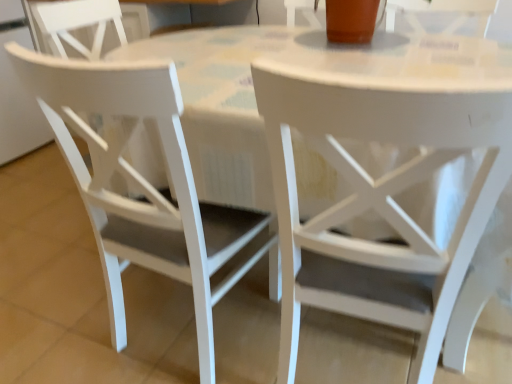
Question: Is white matte chair at center, which is counted as the first chair, starting from the right, behind white matte chair at left, which is the 2th chair in right-to-left order?

Choices:
 (A) yes
 (B) no

Answer: (B)

Question: Is white matte chair at center, positioned as the second chair in left-to-right order, shorter than white matte chair at left, which is the 2th chair in right-to-left order?

Choices:
 (A) no
 (B) yes

Answer: (A)

Question: Does white matte chair at center, which is counted as the first chair, starting from the right, have a larger size compared to white matte chair at left, which is the 2th chair in right-to-left order?

Choices:
 (A) no
 (B) yes

Answer: (B)

Question: From the image's perspective, is white matte chair at center, which is counted as the first chair, starting from the right, under white matte chair at left, the 1th chair when ordered from left to right?

Choices:
 (A) yes
 (B) no

Answer: (A)

Question: From a real-world perspective, is white matte chair at center, positioned as the second chair in left-to-right order, over white matte chair at left, which is the 2th chair in right-to-left order?

Choices:
 (A) yes
 (B) no

Answer: (B)

Question: Does white matte chair at center, which is counted as the first chair, starting from the right, turn towards white matte chair at left, the 1th chair when ordered from left to right?

Choices:
 (A) yes
 (B) no

Answer: (B)

Question: Is white matte chair at left, the 1th chair when ordered from left to right, positioned with its back to white matte chair at center, positioned as the second chair in left-to-right order?

Choices:
 (A) yes
 (B) no

Answer: (B)

Question: From a real-world perspective, is white matte chair at left, the 1th chair when ordered from left to right, on white matte chair at center, positioned as the second chair in left-to-right order?

Choices:
 (A) no
 (B) yes

Answer: (B)

Question: Is white matte chair at left, the 1th chair when ordered from left to right, wider than white matte chair at center, which is counted as the first chair, starting from the right?

Choices:
 (A) yes
 (B) no

Answer: (B)

Question: Is white matte chair at left, the 1th chair when ordered from left to right, oriented towards white matte chair at center, positioned as the second chair in left-to-right order?

Choices:
 (A) no
 (B) yes

Answer: (A)

Question: Is white matte chair at left, which is the 2th chair in right-to-left order, not close to white matte chair at center, positioned as the second chair in left-to-right order?

Choices:
 (A) yes
 (B) no

Answer: (B)

Question: Does white matte chair at left, which is the 2th chair in right-to-left order, have a smaller size compared to white matte chair at center, positioned as the second chair in left-to-right order?

Choices:
 (A) no
 (B) yes

Answer: (B)

Question: Considering the positions of white matte chair at left, the 1th chair when ordered from left to right, and white matte chair at center, positioned as the second chair in left-to-right order, in the image, is white matte chair at left, the 1th chair when ordered from left to right, taller or shorter than white matte chair at center, positioned as the second chair in left-to-right order,?

Choices:
 (A) short
 (B) tall

Answer: (A)